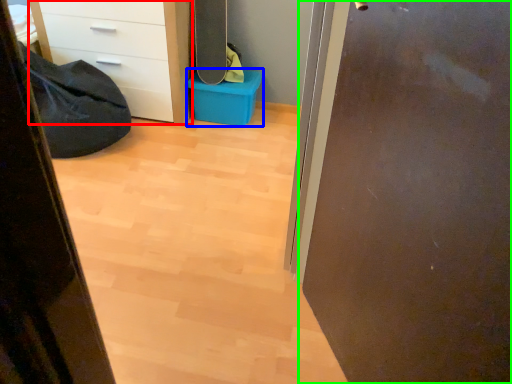
Question: Which is farther away from chest of drawers (highlighted by a red box)? storage box (highlighted by a blue box) or door (highlighted by a green box)?

Choices:
 (A) storage box
 (B) door

Answer: (B)